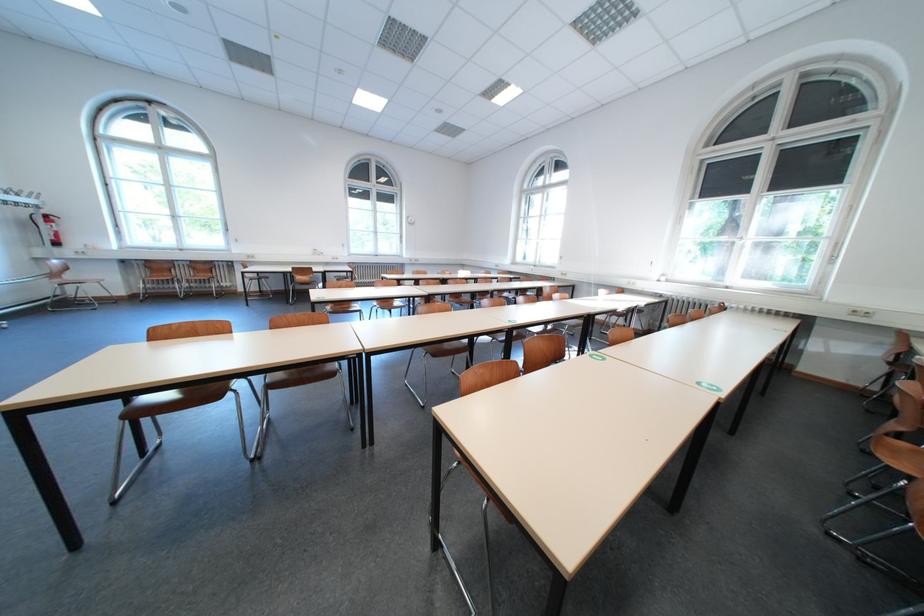
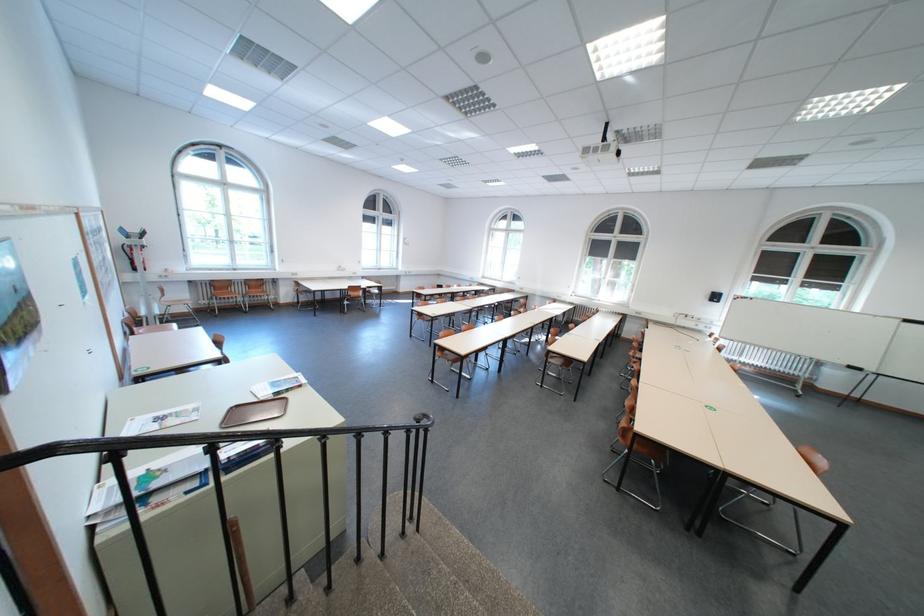
The point at (154, 274) is marked in the first image. Where is the corresponding point in the second image?

(219, 292)